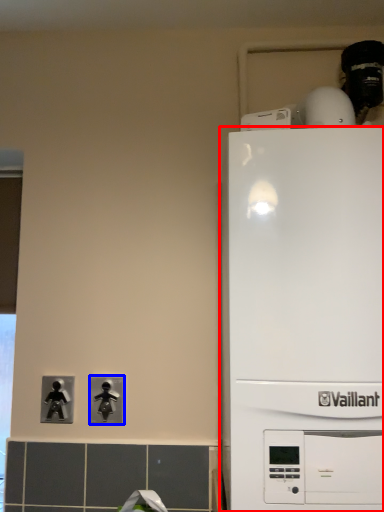
Question: Which point is further to the camera, home appliance (highlighted by a red box) or light switch (highlighted by a blue box)?

Choices:
 (A) home appliance
 (B) light switch

Answer: (B)